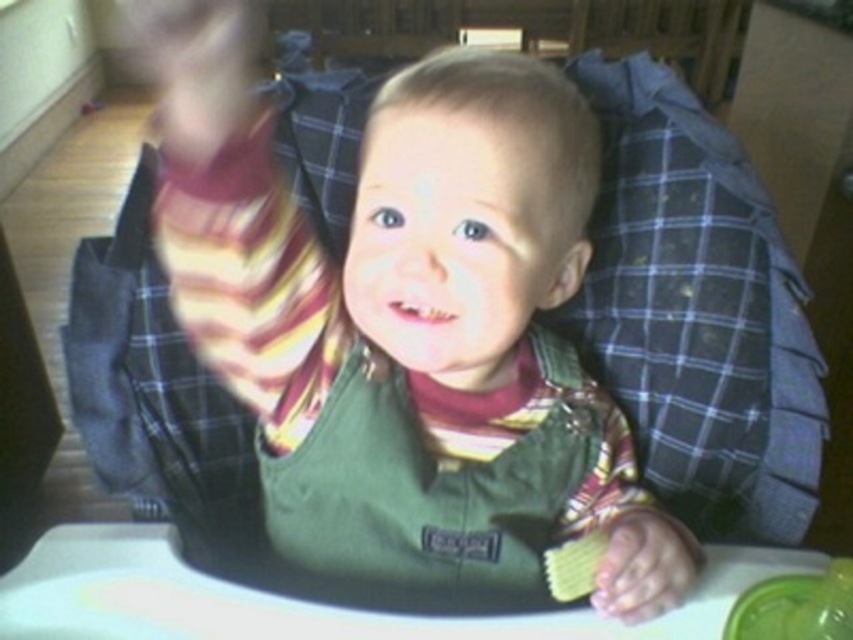
Which is more to the right, green fabric bib at center or smooth skin hand at center?

smooth skin hand at center

Based on the photo, is green fabric bib at center closer to the viewer compared to smooth skin hand at center?

Yes, green fabric bib at center is in front of smooth skin hand at center.

What do you see at coordinates (381, 289) in the screenshot?
I see `green fabric bib at center` at bounding box center [381, 289].

Locate an element on the screen. This screenshot has height=640, width=853. green fabric bib at center is located at coordinates (381, 289).